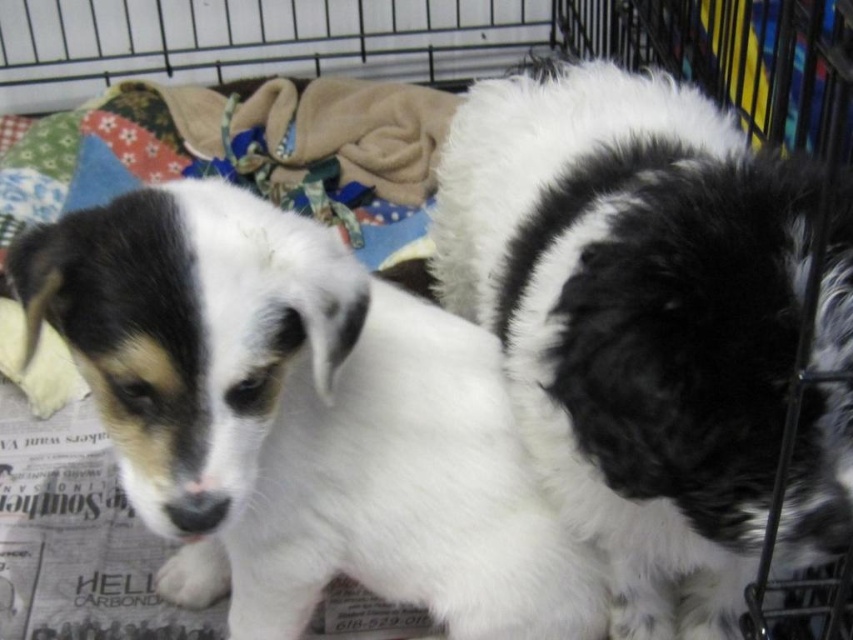
Question: Which object is positioned farthest from the white fur dog at center?

Choices:
 (A) white fluffy dog at center
 (B) fluffy fleece blanket at upper left

Answer: (B)

Question: Based on their relative distances, which object is farther from the white fluffy dog at center?

Choices:
 (A) white fur dog at center
 (B) fluffy fleece blanket at upper left

Answer: (B)

Question: Does white fur dog at center lie in front of fluffy fleece blanket at upper left?

Choices:
 (A) yes
 (B) no

Answer: (A)

Question: Is white fluffy dog at center thinner than fluffy fleece blanket at upper left?

Choices:
 (A) no
 (B) yes

Answer: (B)

Question: Is white fluffy dog at center to the right of white fur dog at center from the viewer's perspective?

Choices:
 (A) yes
 (B) no

Answer: (A)

Question: Which of the following is the closest to the observer?

Choices:
 (A) white fluffy dog at center
 (B) fluffy fleece blanket at upper left

Answer: (A)